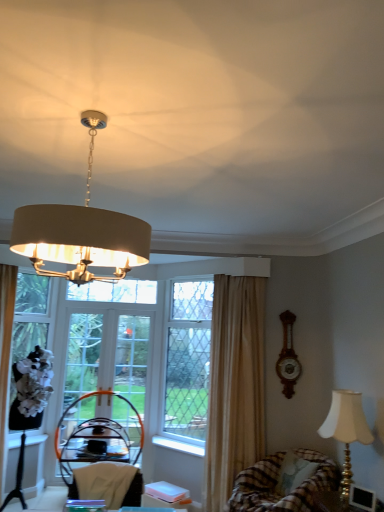
This screenshot has height=512, width=384. What do you see at coordinates (234, 385) in the screenshot?
I see `beige fabric curtain at center` at bounding box center [234, 385].

Measure the distance between beige fabric curtain at center and camera.

beige fabric curtain at center and camera are 12.51 feet apart from each other.

I want to click on white wood window sill at lower left, the 1th window sill in the left-to-right sequence, so click(x=35, y=439).

Describe the element at coordinates (35, 439) in the screenshot. I see `white wood window sill at lower left, the 1th window sill in the left-to-right sequence` at that location.

This screenshot has height=512, width=384. Describe the element at coordinates (108, 484) in the screenshot. I see `white fabric armchair at lower center, the 2th armchair in the back-to-front sequence` at that location.

Locate an element on the screen. This screenshot has width=384, height=512. white plastic round table at lower center is located at coordinates (165, 495).

At what (x,y) coordinates should I click in order to perform the action: click on matte beige lampshade at upper center, placed as the 1th lamp when sorted from left to right. Please return your answer as a coordinate pair (x, y). This screenshot has height=512, width=384. Looking at the image, I should click on (81, 232).

In order to click on wooden clock at right in this screenshot , I will do `click(288, 357)`.

Based on the photo, from a real-world perspective, which is physically above, clear glass window screen at center, marked as the second window screen in a left-to-right arrangement, or matte beige lampshade at upper center, which is counted as the 2th lamp, starting from the right?

matte beige lampshade at upper center, which is counted as the 2th lamp, starting from the right, from a real-world perspective.

Looking at this image, from the image's perspective, is clear glass window screen at center, marked as the second window screen in a left-to-right arrangement, beneath matte beige lampshade at upper center, which appears as the second lamp when ordered from the bottom?

Yes, from the image's perspective, clear glass window screen at center, marked as the second window screen in a left-to-right arrangement, is below matte beige lampshade at upper center, which appears as the second lamp when ordered from the bottom.

Is point (177, 289) closer or farther from the camera than point (86, 119)?

Point (177, 289).

Is clear glass window screen at center, marked as the second window screen in a left-to-right arrangement, situated inside matte beige lampshade at upper center, which is the 2th lamp in back-to-front order, or outside?

clear glass window screen at center, marked as the second window screen in a left-to-right arrangement, is not inside matte beige lampshade at upper center, which is the 2th lamp in back-to-front order, it's outside.

Which is in front, point (179, 506) or point (32, 282)?

Positioned in front is point (179, 506).

Is white plastic round table at lower center positioned before clear glass window screen at left, the second window screen positioned from the right?

Yes, it is in front of clear glass window screen at left, the second window screen positioned from the right.

Which object is wider, white plastic round table at lower center or clear glass window screen at left, acting as the first window screen starting from the left?

white plastic round table at lower center.

Can you tell me how much white plastic round table at lower center and clear glass window screen at left, acting as the first window screen starting from the left, differ in facing direction?

The angular difference between white plastic round table at lower center and clear glass window screen at left, acting as the first window screen starting from the left, is 91 degrees.

Is clear glass window screen at left, the second window screen positioned from the right, closer to the viewer compared to gold metallic lampshade at lower right, the 1th lamp from the right?

No, clear glass window screen at left, the second window screen positioned from the right, is further to the viewer.

Would you say gold metallic lampshade at lower right, the 1th lamp positioned from the back, is part of clear glass window screen at left, acting as the first window screen starting from the left,'s contents?

No, gold metallic lampshade at lower right, the 1th lamp positioned from the back, is located outside of clear glass window screen at left, acting as the first window screen starting from the left.

Is clear glass window screen at left, the second window screen positioned from the right, oriented away from gold metallic lampshade at lower right, the 2th lamp from the left?

That's not correct — clear glass window screen at left, the second window screen positioned from the right, is not looking away from gold metallic lampshade at lower right, the 2th lamp from the left.

From the image's perspective, is clear glass window screen at left, the second window screen positioned from the right, above or below gold metallic lampshade at lower right, the 2th lamp in the front-to-back sequence?

Based on their image positions, clear glass window screen at left, the second window screen positioned from the right, is located above gold metallic lampshade at lower right, the 2th lamp in the front-to-back sequence.

Considering the relative positions of black woven armchair at center, the second armchair positioned from the top, and gold metallic lampshade at lower right, the 2th lamp in the front-to-back sequence, in the image provided, is black woven armchair at center, the second armchair positioned from the top, to the left or to the right of gold metallic lampshade at lower right, the 2th lamp in the front-to-back sequence,?

From the image, it's evident that black woven armchair at center, the second armchair positioned from the top, is to the left of gold metallic lampshade at lower right, the 2th lamp in the front-to-back sequence.

Who is taller, black woven armchair at center, the second armchair positioned from the top, or gold metallic lampshade at lower right, the 2th lamp from the left?

black woven armchair at center, the second armchair positioned from the top, is taller.

Considering the sizes of black woven armchair at center, acting as the 1th armchair starting from the bottom, and gold metallic lampshade at lower right, which is the first lamp in bottom-to-top order, in the image, is black woven armchair at center, acting as the 1th armchair starting from the bottom, bigger or smaller than gold metallic lampshade at lower right, which is the first lamp in bottom-to-top order,?

Clearly, black woven armchair at center, acting as the 1th armchair starting from the bottom, is larger in size than gold metallic lampshade at lower right, which is the first lamp in bottom-to-top order.

Considering the positions of objects clear glass window screen at center, acting as the 1th window screen starting from the right, and white glass screen door at center, the 1th screen door when ordered from left to right, in the image provided, who is more to the right, clear glass window screen at center, acting as the 1th window screen starting from the right, or white glass screen door at center, the 1th screen door when ordered from left to right,?

clear glass window screen at center, acting as the 1th window screen starting from the right.

Considering the sizes of clear glass window screen at center, marked as the second window screen in a left-to-right arrangement, and white glass screen door at center, the 1th screen door when ordered from left to right, in the image, is clear glass window screen at center, marked as the second window screen in a left-to-right arrangement, wider or thinner than white glass screen door at center, the 1th screen door when ordered from left to right,?

In the image, clear glass window screen at center, marked as the second window screen in a left-to-right arrangement, appears to be wider than white glass screen door at center, the 1th screen door when ordered from left to right.

Considering the sizes of objects clear glass window screen at center, acting as the 1th window screen starting from the right, and white glass screen door at center, the 1th screen door when ordered from left to right, in the image provided, who is smaller, clear glass window screen at center, acting as the 1th window screen starting from the right, or white glass screen door at center, the 1th screen door when ordered from left to right,?

white glass screen door at center, the 1th screen door when ordered from left to right, is smaller.

Relative to white glass screen door at center, which is the 2th screen door in right-to-left order, is clear glass window screen at center, marked as the second window screen in a left-to-right arrangement, in front or behind?

Visually, clear glass window screen at center, marked as the second window screen in a left-to-right arrangement, is located in front of white glass screen door at center, which is the 2th screen door in right-to-left order.

Looking at this image, is white plastic round table at lower center turned away from beige fabric curtain at center?

No, beige fabric curtain at center is not at the back of white plastic round table at lower center.

How much distance is there between white plastic round table at lower center and beige fabric curtain at center?

They are 1.00 meters apart.

Does white plastic round table at lower center have a larger size compared to beige fabric curtain at center?

Incorrect, white plastic round table at lower center is not larger than beige fabric curtain at center.

In the image, there is a beige fabric curtain at center. Where is `round table below it (from the image's perspective)`? This screenshot has height=512, width=384. round table below it (from the image's perspective) is located at coordinates (165, 495).

In the scene shown: From a real-world perspective, who is located lower, matte beige lampshade at upper center, which appears as the second lamp when ordered from the bottom, or clear glass window screen at left, the second window screen positioned from the right?

In real-world perspective, clear glass window screen at left, the second window screen positioned from the right, is lower.

Which is less distant, (108, 241) or (16, 356)?

The point (108, 241) is closer.

Could you tell me if matte beige lampshade at upper center, the first lamp positioned from the front, is facing clear glass window screen at left, the second window screen positioned from the right?

No, matte beige lampshade at upper center, the first lamp positioned from the front, is not turned towards clear glass window screen at left, the second window screen positioned from the right.

Does matte beige lampshade at upper center, placed as the 1th lamp when sorted from left to right, have a smaller size compared to clear glass window screen at left, acting as the first window screen starting from the left?

Yes.

Which window screen is the 2nd one when counting from the back of the matte beige lampshade at upper center, which appears as the second lamp when ordered from the bottom? Please provide its 2D coordinates.

[(188, 359)]

In order to click on round table on the right of clear glass window screen at left, the second window screen positioned from the right in this screenshot , I will do `click(165, 495)`.

Based on their spatial positions, is white plastic window sill at lower center, the 2th window sill viewed from the left, or black woven armchair at center, which is the second armchair in front-to-back order, further from clear glass window screen at left, the second window screen positioned from the right?

white plastic window sill at lower center, the 2th window sill viewed from the left, is further to clear glass window screen at left, the second window screen positioned from the right.

Looking at the image, which one is located closer to white plastic window sill at lower center, the 2th window sill viewed from the left, black woven armchair at center, which is the second armchair in front-to-back order, or white glass screen door at center, the 1th screen door when ordered from left to right?

black woven armchair at center, which is the second armchair in front-to-back order, is positioned closer to the anchor white plastic window sill at lower center, the 2th window sill viewed from the left.

Considering their positions, is white wood window sill at lower left, the 1th window sill in the left-to-right sequence, positioned further to beige fabric curtain at center than black woven armchair at center, which is the second armchair in front-to-back order?

white wood window sill at lower left, the 1th window sill in the left-to-right sequence, lies further to beige fabric curtain at center than the other object.

When comparing their distances from white plastic round table at lower center, does clear glass window screen at left, acting as the first window screen starting from the left, or white plastic window sill at lower center, marked as the 1th window sill in a right-to-left arrangement, seem closer?

Among the two, white plastic window sill at lower center, marked as the 1th window sill in a right-to-left arrangement, is located nearer to white plastic round table at lower center.

From the image, which object appears to be nearer to gold metallic lampshade at lower right, the 2th lamp in the front-to-back sequence, white plastic window sill at lower center, marked as the 1th window sill in a right-to-left arrangement, or white fabric armchair at lower center, the 2th armchair in the back-to-front sequence?

Based on the image, white fabric armchair at lower center, the 2th armchair in the back-to-front sequence, appears to be nearer to gold metallic lampshade at lower right, the 2th lamp in the front-to-back sequence.

From the image, which object appears to be nearer to black woven armchair at center, which is the second armchair in front-to-back order, matte beige lampshade at upper center, which is counted as the 2th lamp, starting from the right, or white plastic round table at lower center?

white plastic round table at lower center is closer to black woven armchair at center, which is the second armchair in front-to-back order.

When comparing their distances from wooden clock at right, does clear glass window screen at left, acting as the first window screen starting from the left, or gold metallic lampshade at lower right, marked as the second lamp in a top-to-bottom arrangement, seem further?

clear glass window screen at left, acting as the first window screen starting from the left, is positioned further to the anchor wooden clock at right.

Based on their spatial positions, is white wood window sill at lower left, the 1th window sill in the left-to-right sequence, or clear glass window screen at left, the second window screen positioned from the right, further from wooden clock at right?

clear glass window screen at left, the second window screen positioned from the right, is positioned further to the anchor wooden clock at right.

Locate an element on the screen. This screenshot has height=512, width=384. curtain between white fabric armchair at lower center, the 2th armchair in the back-to-front sequence, and white plastic round table at lower center in the front-back direction is located at coordinates (234, 385).

The width and height of the screenshot is (384, 512). In order to click on swivel chair between matte beige lampshade at upper center, which is counted as the 2th lamp, starting from the right, and white plastic round table at lower center, in the vertical direction in this screenshot , I will do tap(276, 483).

The height and width of the screenshot is (512, 384). In order to click on swivel chair between beige fabric curtain at center and white plastic round table at lower center in the vertical direction in this screenshot , I will do `click(276, 483)`.

The height and width of the screenshot is (512, 384). In order to click on swivel chair between white glass screen door at center, which is the 2th screen door in right-to-left order, and gold metallic lampshade at lower right, the 1th lamp positioned from the back in this screenshot , I will do coord(276,483).